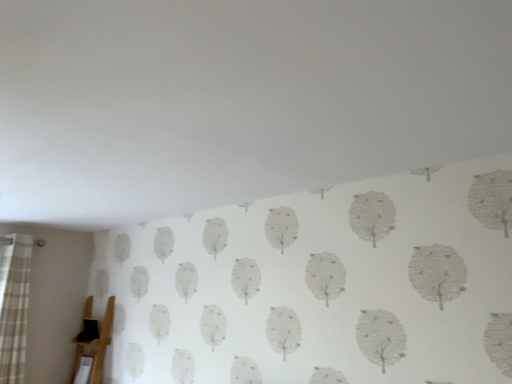
Question: From a real-world perspective, is wooden easel at lower left physically above plaid fabric curtain at left?

Choices:
 (A) no
 (B) yes

Answer: (A)

Question: From a real-world perspective, is wooden easel at lower left positioned under plaid fabric curtain at left based on gravity?

Choices:
 (A) yes
 (B) no

Answer: (A)

Question: From the image's perspective, is wooden easel at lower left above plaid fabric curtain at left?

Choices:
 (A) no
 (B) yes

Answer: (A)

Question: Does wooden easel at lower left contain plaid fabric curtain at left?

Choices:
 (A) no
 (B) yes

Answer: (A)

Question: Is wooden easel at lower left aimed at plaid fabric curtain at left?

Choices:
 (A) yes
 (B) no

Answer: (A)

Question: Can you confirm if wooden easel at lower left is thinner than plaid fabric curtain at left?

Choices:
 (A) no
 (B) yes

Answer: (A)

Question: Can you confirm if plaid fabric curtain at left is taller than wooden easel at lower left?

Choices:
 (A) no
 (B) yes

Answer: (B)

Question: Is plaid fabric curtain at left facing away from wooden easel at lower left?

Choices:
 (A) yes
 (B) no

Answer: (B)

Question: Considering the relative sizes of plaid fabric curtain at left and wooden easel at lower left in the image provided, is plaid fabric curtain at left thinner than wooden easel at lower left?

Choices:
 (A) no
 (B) yes

Answer: (B)

Question: Considering the relative positions of plaid fabric curtain at left and wooden easel at lower left in the image provided, is plaid fabric curtain at left behind wooden easel at lower left?

Choices:
 (A) yes
 (B) no

Answer: (B)

Question: Does plaid fabric curtain at left come in front of wooden easel at lower left?

Choices:
 (A) yes
 (B) no

Answer: (A)

Question: Is plaid fabric curtain at left smaller than wooden easel at lower left?

Choices:
 (A) yes
 (B) no

Answer: (B)

Question: Considering the positions of plaid fabric curtain at left and wooden easel at lower left in the image, is plaid fabric curtain at left taller or shorter than wooden easel at lower left?

Choices:
 (A) short
 (B) tall

Answer: (B)